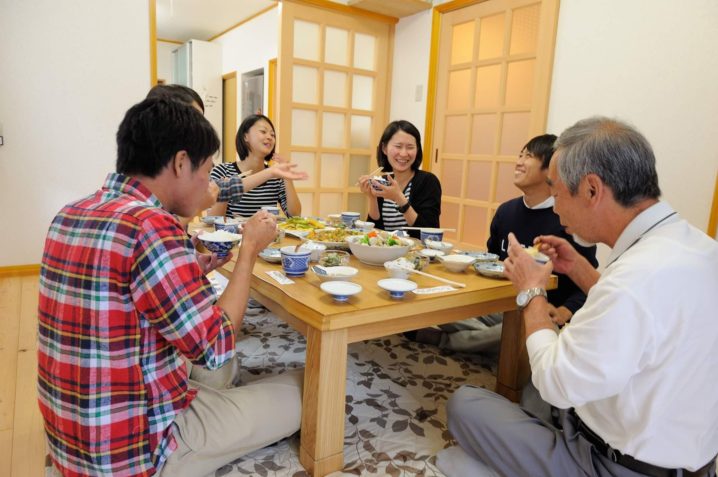
At what (x,y) coordinates should I click in order to perform the action: click on area rug. Please return your answer as a coordinate pair (x, y). Image resolution: width=718 pixels, height=477 pixels. Looking at the image, I should click on (396, 410).